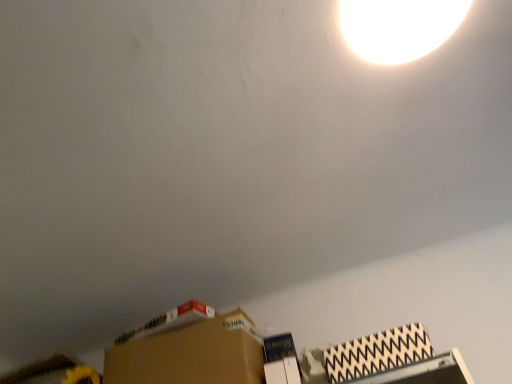
Question: From a real-world perspective, relative to white glossy lampshade at upper center, is patterned cardboard box at lower right, positioned as the 2th cardboard box in back-to-front order, vertically above or below?

Choices:
 (A) below
 (B) above

Answer: (A)

Question: Looking at the image, does patterned cardboard box at lower right, the 1th cardboard box from the right, seem bigger or smaller compared to white glossy lampshade at upper center?

Choices:
 (A) big
 (B) small

Answer: (A)

Question: Which of these objects is positioned closest to the patterned cardboard box at lower right, the 1th cardboard box positioned from the front?

Choices:
 (A) brown cardboard box at lower center, marked as the second cardboard box in a right-to-left arrangement
 (B) white glossy lampshade at upper center

Answer: (A)

Question: Estimate the real-world distances between objects in this image. Which object is farther from the brown cardboard box at lower center, the 1th cardboard box in the left-to-right sequence?

Choices:
 (A) white glossy lampshade at upper center
 (B) patterned cardboard box at lower right, the 1th cardboard box positioned from the front

Answer: (A)